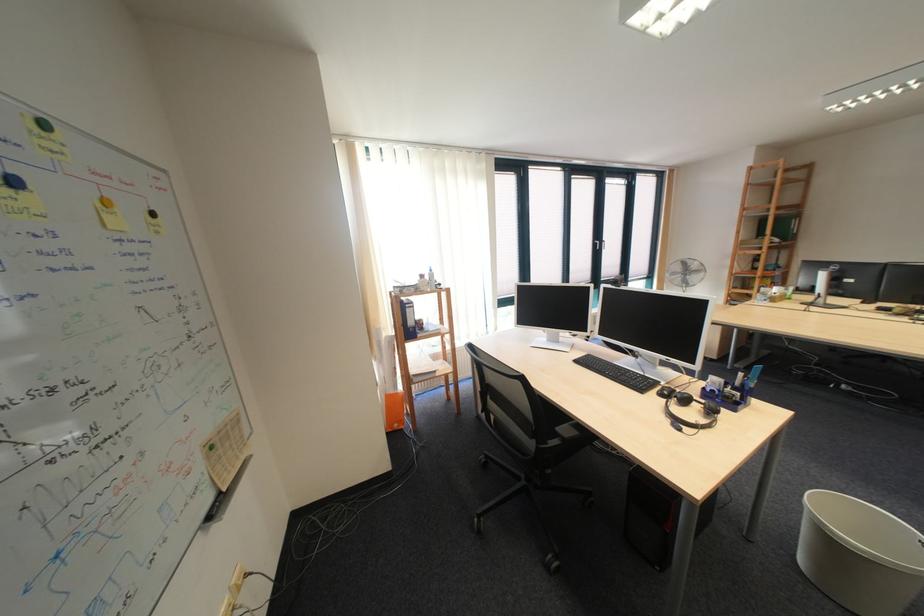
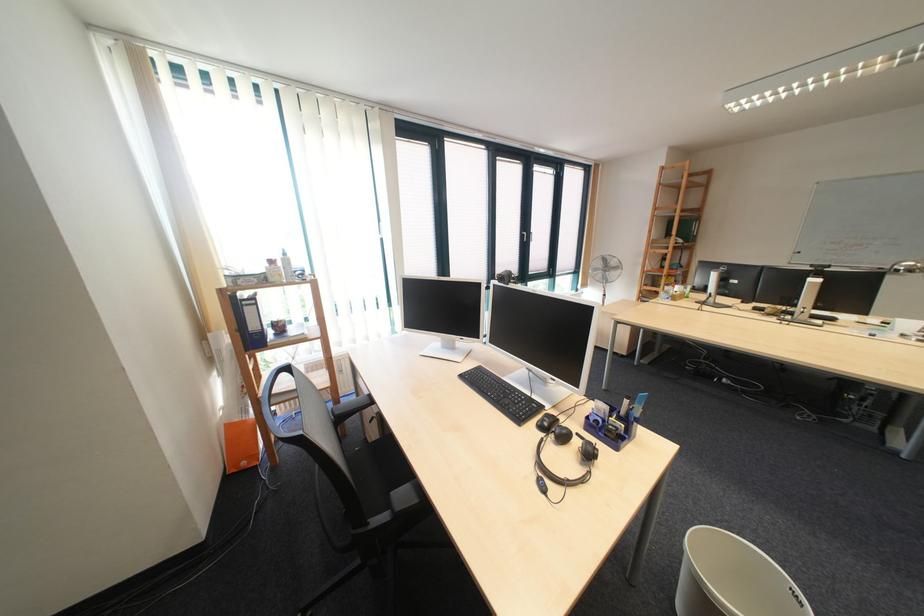
Question: The first image is from the beginning of the video and the second image is from the end. How did the camera likely rotate when shooting the video?

Choices:
 (A) Left
 (B) Right
 (C) Up
 (D) Down

Answer: (B)